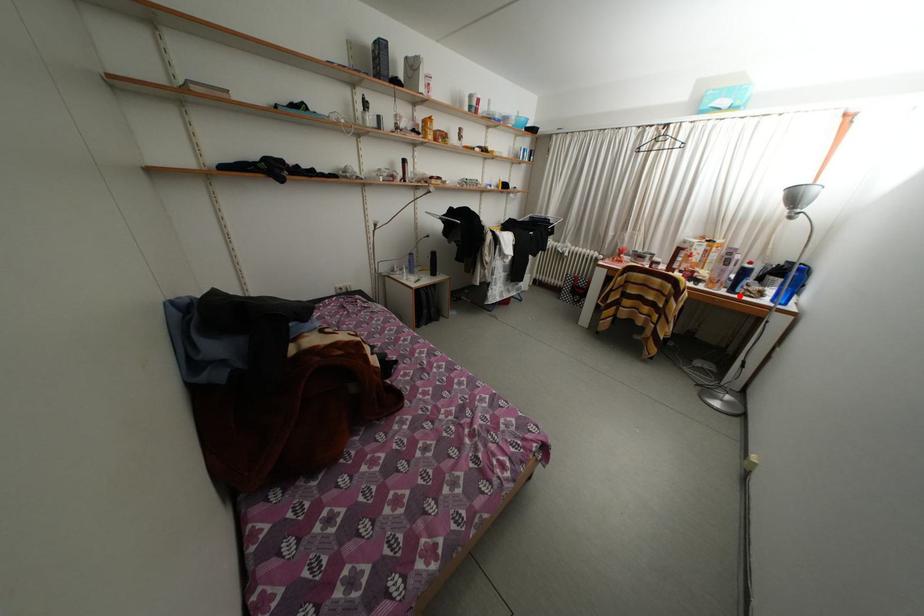
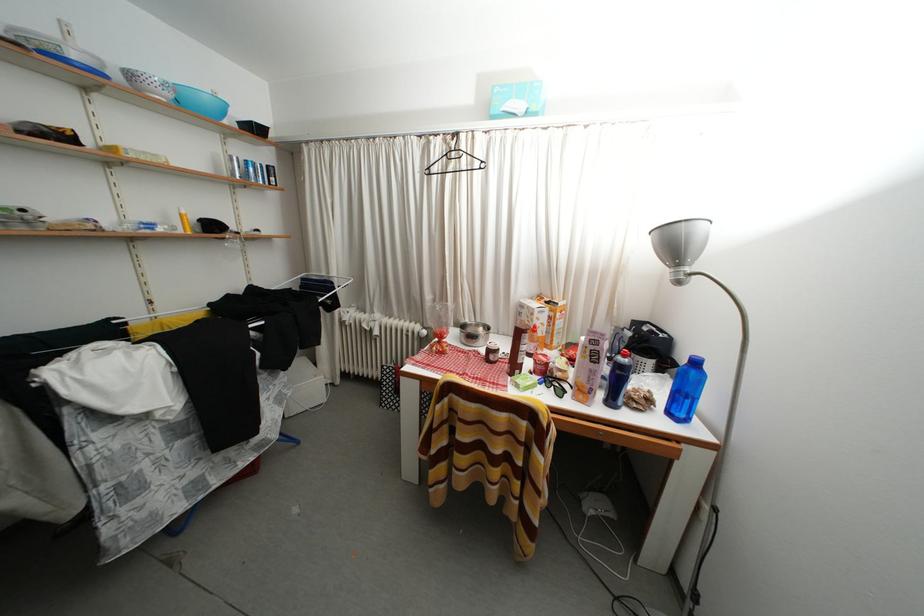
Where in the second image is the point corresponding to the highlighted location from the first image?

(618, 408)